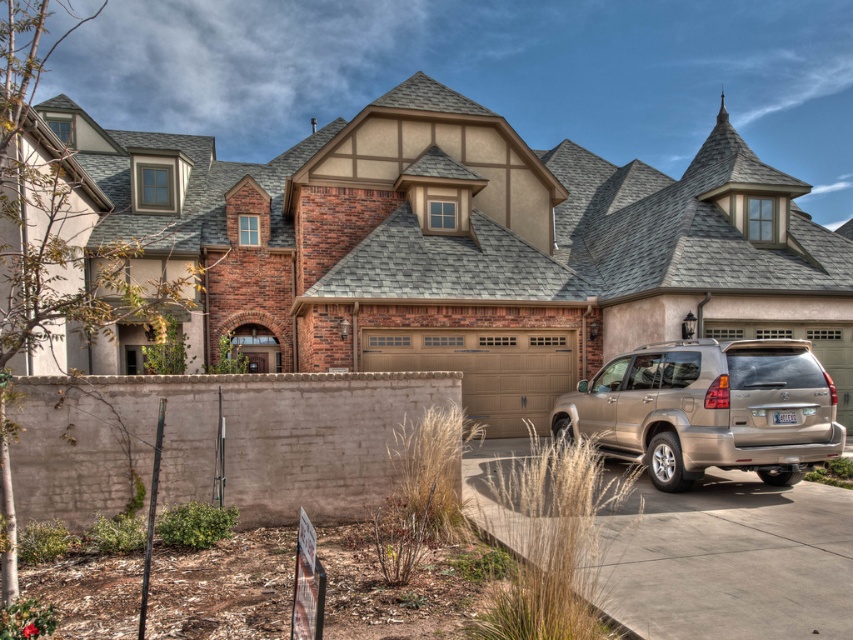
You are standing in front of the house and want to determine the relative positions of two points marked in the image. Which point is closer to you, point (758, 618) or point (492, 420)?

Point (758, 618) is closer to the viewer than point (492, 420).